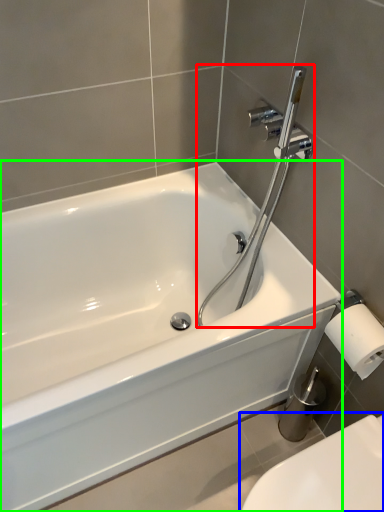
Question: Based on their relative distances, which object is nearer to plumbing fixture (highlighted by a red box)? Choose from toilet (highlighted by a blue box) and bathtub (highlighted by a green box).

Choices:
 (A) toilet
 (B) bathtub

Answer: (B)